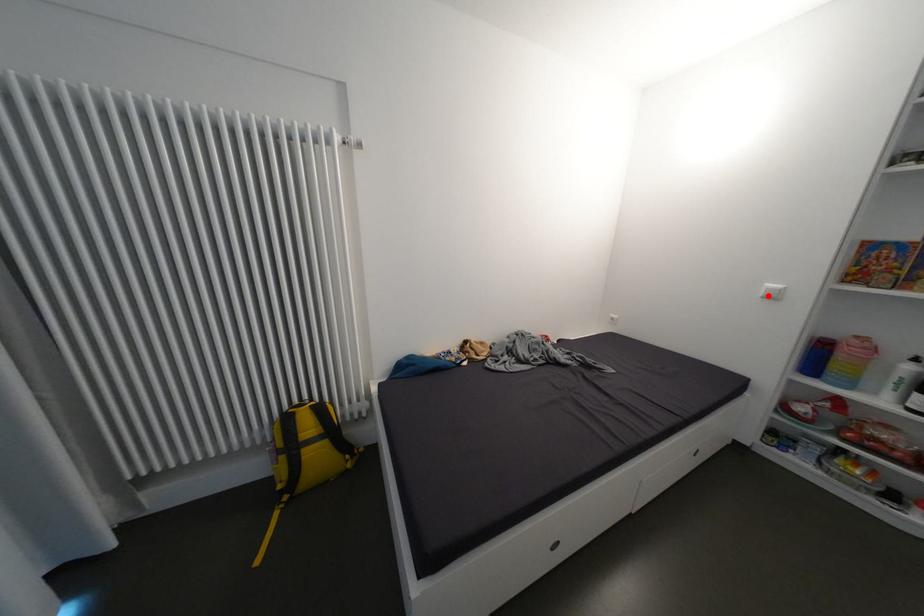
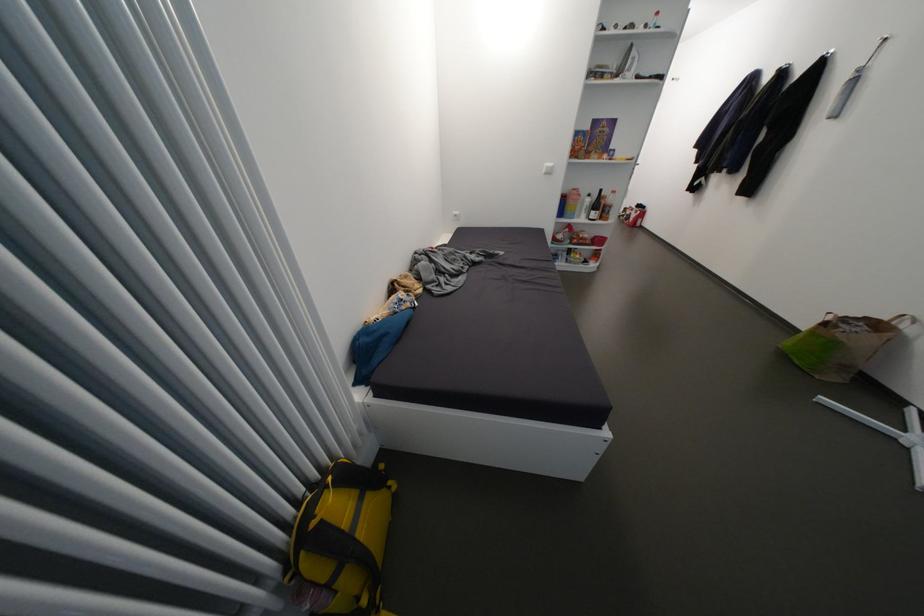
The point at the highlighted location is marked in the first image. Where is the corresponding point in the second image?

(552, 174)